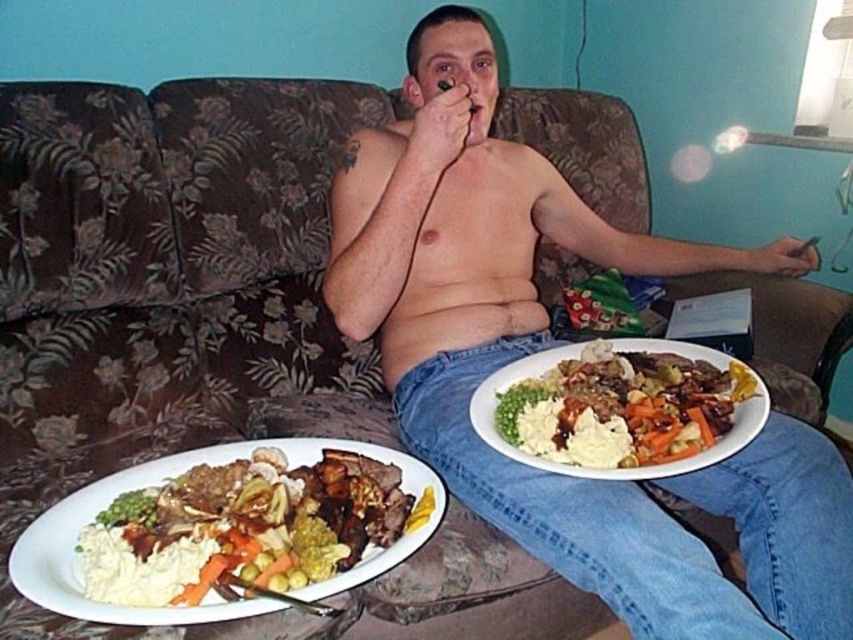
You are a GUI agent. You are given a task and a screenshot of the screen. Output one action in this format:
    pyautogui.click(x=<x>, y=<y>)
    Task: Click on the smooth skin torso at center
    
    Given the screenshot: What is the action you would take?
    pyautogui.click(x=548, y=344)

From the picture: Does smooth skin torso at center appear under smooth white plate at lower center?

No.

Who is more distant from viewer, (473, 204) or (755, 394)?

Positioned behind is point (473, 204).

At what (x,y) coordinates should I click in order to perform the action: click on smooth skin torso at center. Please return your answer as a coordinate pair (x, y). This screenshot has width=853, height=640. Looking at the image, I should click on tap(548, 344).

Who is positioned more to the left, white creamy mashed potatoes at lower left or smooth white plate at lower center?

white creamy mashed potatoes at lower left is more to the left.

Does white creamy mashed potatoes at lower left have a greater width compared to smooth white plate at lower center?

No.

Where is `white creamy mashed potatoes at lower left`? This screenshot has width=853, height=640. white creamy mashed potatoes at lower left is located at coordinates click(x=244, y=529).

Does smooth skin torso at center have a greater height compared to white creamy mashed potatoes at lower left?

Indeed, smooth skin torso at center has a greater height compared to white creamy mashed potatoes at lower left.

Does point (347, 192) lie behind point (129, 586)?

That is True.

Which is behind, point (387, 368) or point (218, 500)?

Point (387, 368)

The width and height of the screenshot is (853, 640). Find the location of `smooth skin torso at center`. smooth skin torso at center is located at coordinates (548, 344).